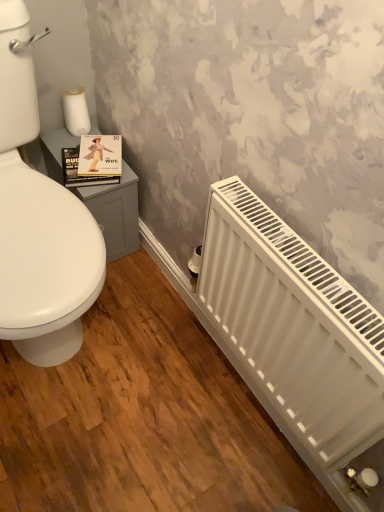
Question: Does matte paper book at upper left have a smaller size compared to white matte toilet paper at upper left?

Choices:
 (A) no
 (B) yes

Answer: (A)

Question: From a real-world perspective, is matte paper book at upper left on top of white matte toilet paper at upper left?

Choices:
 (A) no
 (B) yes

Answer: (A)

Question: Does matte paper book at upper left appear on the left side of white matte toilet paper at upper left?

Choices:
 (A) no
 (B) yes

Answer: (A)

Question: Is white matte toilet paper at upper left at the back of matte paper book at upper left?

Choices:
 (A) yes
 (B) no

Answer: (B)

Question: Is matte paper book at upper left aimed at white matte toilet paper at upper left?

Choices:
 (A) no
 (B) yes

Answer: (A)

Question: Is matte paper book at upper left thinner than white matte toilet paper at upper left?

Choices:
 (A) yes
 (B) no

Answer: (B)

Question: Is matte paper book at upper left smaller than white matte radiator at lower right?

Choices:
 (A) yes
 (B) no

Answer: (A)

Question: Does matte paper book at upper left have a lesser height compared to white matte radiator at lower right?

Choices:
 (A) no
 (B) yes

Answer: (B)

Question: Is matte paper book at upper left closer to camera compared to white matte radiator at lower right?

Choices:
 (A) no
 (B) yes

Answer: (A)

Question: Is matte paper book at upper left outside white matte radiator at lower right?

Choices:
 (A) no
 (B) yes

Answer: (B)

Question: From a real-world perspective, is matte paper book at upper left physically below white matte radiator at lower right?

Choices:
 (A) yes
 (B) no

Answer: (A)

Question: Can you confirm if matte paper book at upper left is thinner than white matte radiator at lower right?

Choices:
 (A) yes
 (B) no

Answer: (B)

Question: Could you tell me if white matte toilet paper at upper left is turned towards white matte radiator at lower right?

Choices:
 (A) yes
 (B) no

Answer: (A)